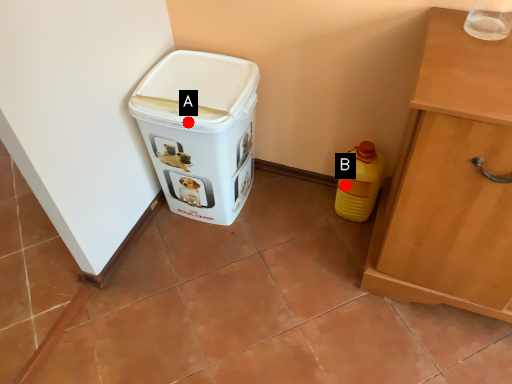
Question: Two points are circled on the image, labeled by A and B beside each circle. Among these points, which one is nearest to the camera?

Choices:
 (A) A is closer
 (B) B is closer

Answer: (A)